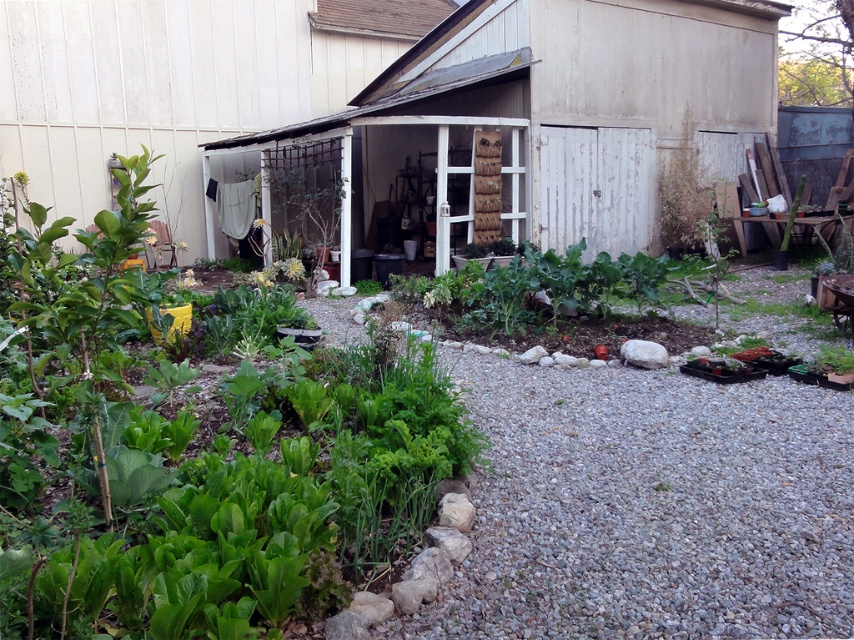
You are planning to place a new tool rack in the garden. You have two options for placement near the white wooden shed at center and the white wood shed at center. Which shed should you choose to place it under for better shelter from rain?

The white wooden shed at center is positioned under the white wood shed at center, so placing the tool rack under the white wood shed at center would provide better shelter from rain.

You are designing a layout for a garden and need to place both the white wooden shed at center and the white wood shed at center. According to the image, which one should you place first to account for their sizes?

The white wooden shed at center should be placed first because it has a larger size compared to the white wood shed at center.